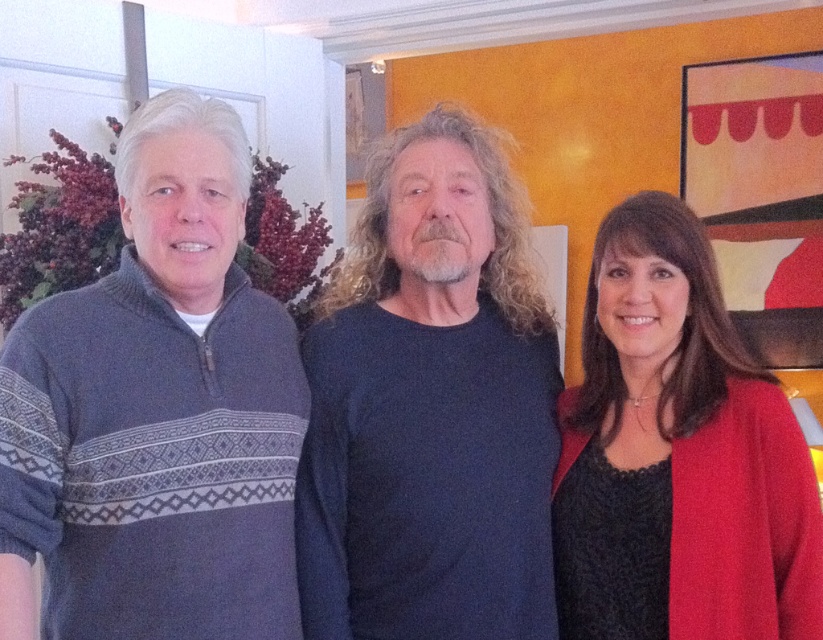
Is dark blue sweater at center to the left of matte red sweater at right from the viewer's perspective?

Correct, you'll find dark blue sweater at center to the left of matte red sweater at right.

Is dark blue sweater at center smaller than matte red sweater at right?

No, dark blue sweater at center is not smaller than matte red sweater at right.

Between point (501, 532) and point (625, 595), which one is positioned in front?

Point (501, 532) is in front.

Where is `dark blue sweater at center`? dark blue sweater at center is located at coordinates point(430,406).

How far apart are knit sweater at left and dark blue sweater at center?

knit sweater at left and dark blue sweater at center are 10.89 inches apart from each other.

Does point (264, 460) come closer to viewer compared to point (482, 417)?

That is True.

At what (x,y) coordinates should I click in order to perform the action: click on knit sweater at left. Please return your answer as a coordinate pair (x, y). Looking at the image, I should click on (156, 413).

Does knit sweater at left appear under matte red sweater at right?

No, knit sweater at left is not below matte red sweater at right.

Which is more to the left, knit sweater at left or matte red sweater at right?

knit sweater at left

Is point (245, 358) farther from camera compared to point (707, 467)?

Yes, point (245, 358) is behind point (707, 467).

Locate an element on the screen. This screenshot has height=640, width=823. knit sweater at left is located at coordinates (156, 413).